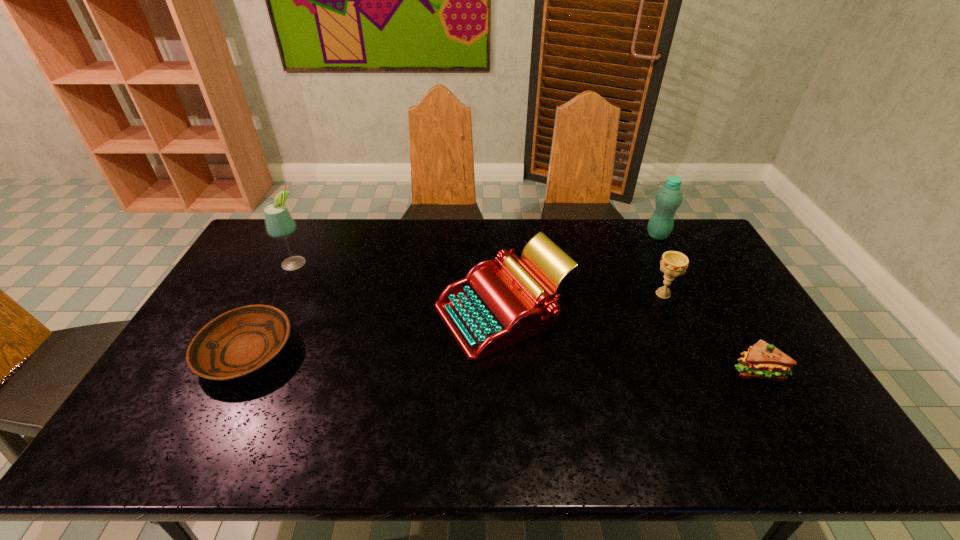
I want to click on free spot located at the front cap of the fifth shortest object, so click(x=584, y=235).

Find the location of a particular element. vacant space located at the front cap of the fifth shortest object is located at coordinates (581, 235).

Find the location of a particular element. free space located at the front cap of the fifth shortest object is located at coordinates (603, 235).

Identify the location of free space located on the typing side of the typewriter. (345, 314).

At what (x,y) coordinates should I click in order to perform the action: click on free space located 0.210m on the typing side of the typewriter. Please return your answer as a coordinate pair (x, y). The image size is (960, 540). Looking at the image, I should click on 365,314.

This screenshot has height=540, width=960. Find the location of `vacant space located on the typing side of the typewriter`. vacant space located on the typing side of the typewriter is located at coordinates (301, 314).

The image size is (960, 540). Find the location of `free space located 0.340m on the left of the third shortest object`. free space located 0.340m on the left of the third shortest object is located at coordinates (543, 294).

Where is `free region located on the left of the fifth tallest object`? free region located on the left of the fifth tallest object is located at coordinates (684, 370).

You are a GUI agent. You are given a task and a screenshot of the screen. Output one action in this format:
    pyautogui.click(x=<x>, y=<y>)
    Task: Click on the vacant space located 0.380m on the right of the shortest object
    The width and height of the screenshot is (960, 540).
    Given the screenshot: What is the action you would take?
    pyautogui.click(x=431, y=353)

Find the location of a particular element. This screenshot has width=960, height=540. alcohol that is at the far edge is located at coordinates (279, 223).